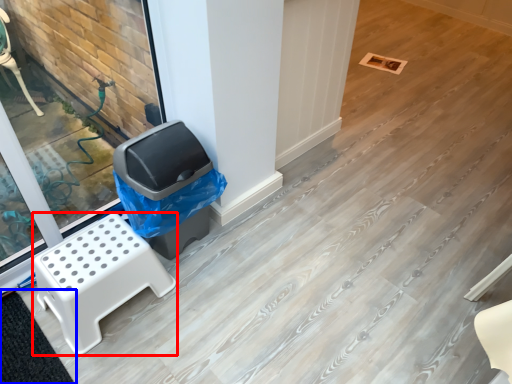
Question: Which of the following is the farthest to the observer, furniture (highlighted by a red box) or mat (highlighted by a blue box)?

Choices:
 (A) furniture
 (B) mat

Answer: (A)